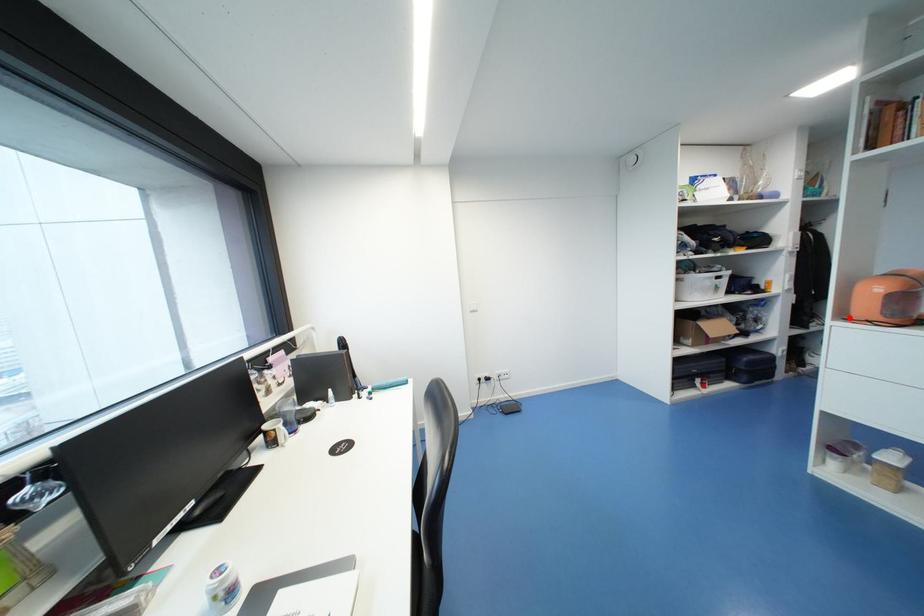
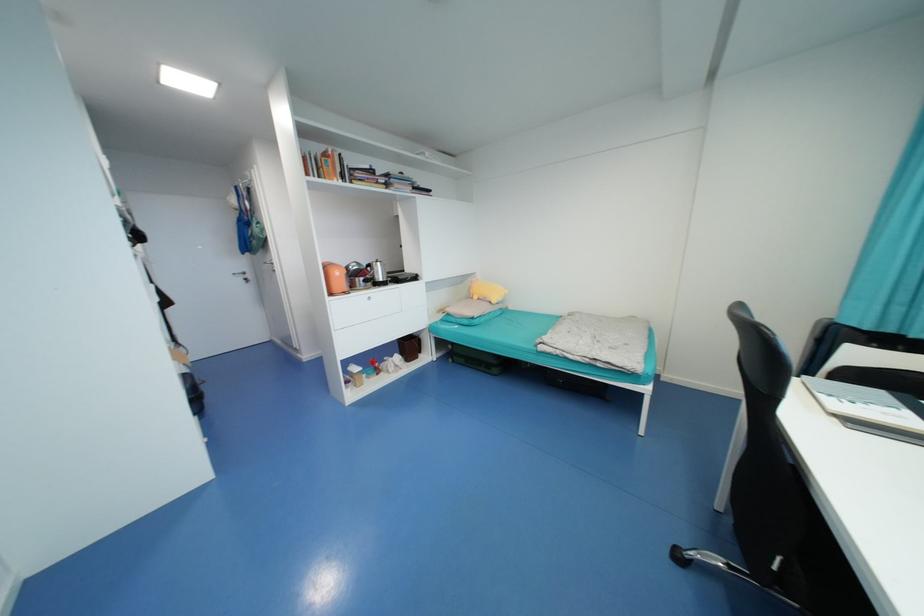
In the second image, find the point that corresponds to the highlighted location in the first image.

(334, 294)